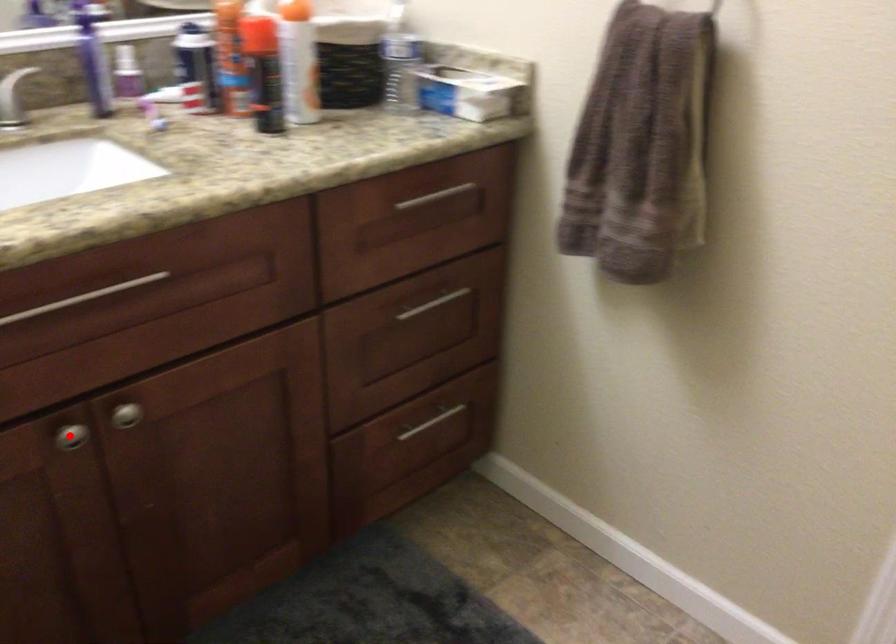
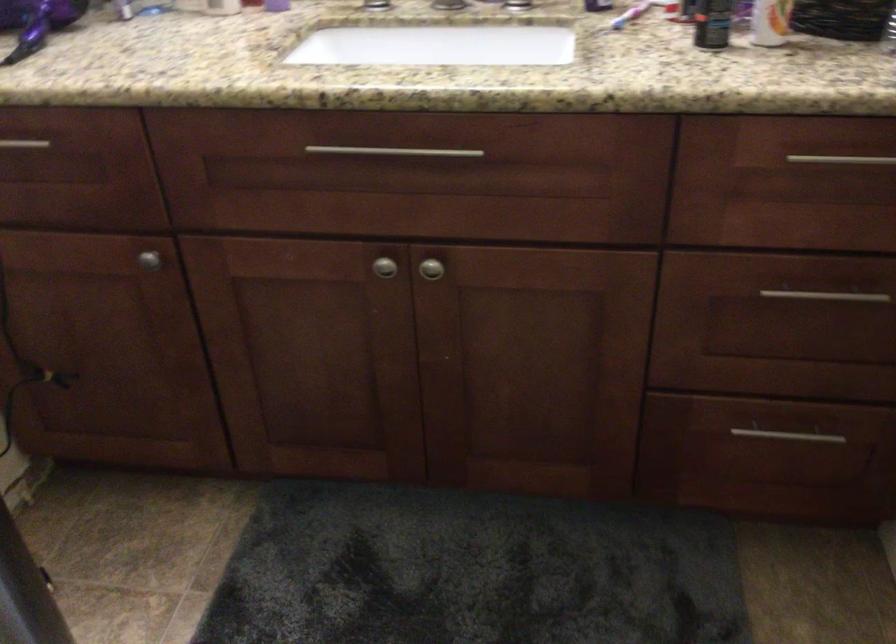
Find the pixel in the second image that matches the highlighted location in the first image.

(383, 267)